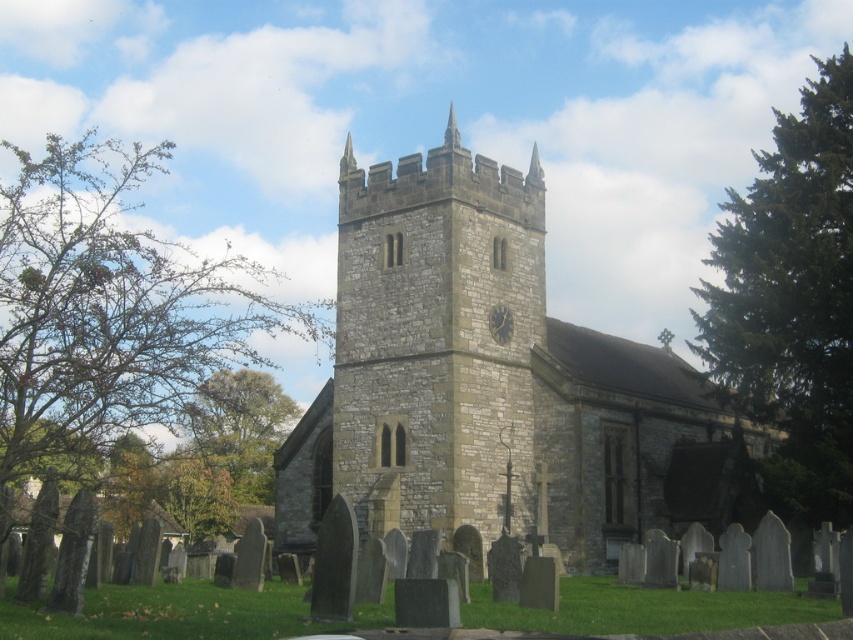
Does stone clock tower at center have a lesser width compared to metallic gray clock at center?

No, stone clock tower at center is not thinner than metallic gray clock at center.

Is stone clock tower at center to the right of metallic gray clock at center from the viewer's perspective?

No, stone clock tower at center is not to the right of metallic gray clock at center.

Identify the location of stone clock tower at center. (436, 339).

Which is more to the right, stone church at center or stone clock tower at center?

stone church at center

I want to click on stone church at center, so click(485, 380).

Between point (635, 353) and point (498, 349), which one is positioned behind?

Point (635, 353)

The height and width of the screenshot is (640, 853). I want to click on stone church at center, so click(x=485, y=380).

Does stone church at center have a lesser height compared to metallic gray clock at center?

No, stone church at center is not shorter than metallic gray clock at center.

Find the location of `stone church at center`. stone church at center is located at coordinates (485, 380).